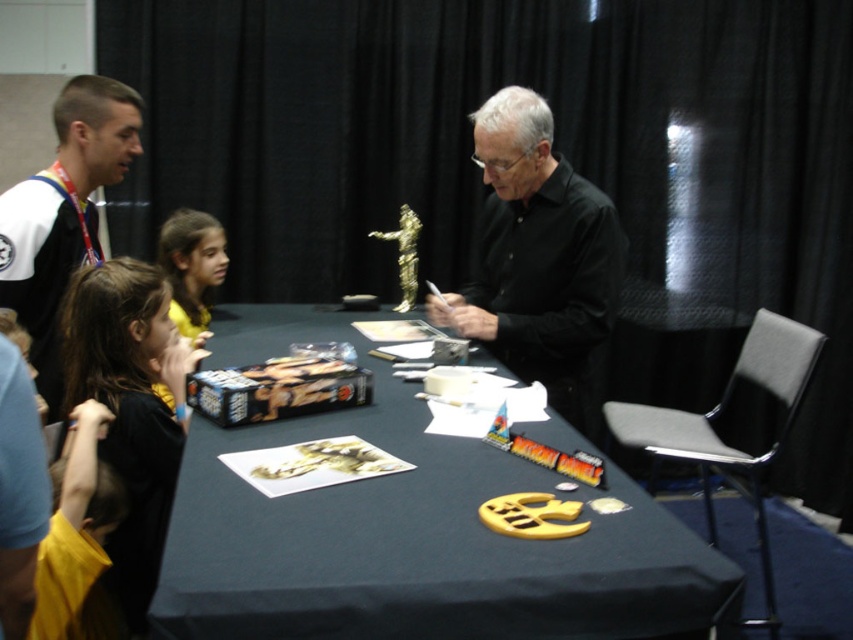
Question: Based on their relative distances, which object is nearer to the black matte shirt at center?

Choices:
 (A) dark brown hair at left
 (B) yellow fabric shirt at lower left

Answer: (A)

Question: Can you confirm if black matte shirt at center is thinner than dark brown hair at left?

Choices:
 (A) no
 (B) yes

Answer: (A)

Question: Which point appears farthest from the camera in this image?

Choices:
 (A) (550, 296)
 (B) (136, 154)
 (C) (621, 525)
 (D) (119, 352)

Answer: (A)

Question: Which point appears farthest from the camera in this image?

Choices:
 (A) (175, 538)
 (B) (126, 547)
 (C) (64, 548)

Answer: (B)

Question: Does matte black table at center have a larger size compared to black matte shirt at center?

Choices:
 (A) yes
 (B) no

Answer: (A)

Question: Can you confirm if black matte shirt at center is positioned below yellow fabric shirt at lower left?

Choices:
 (A) no
 (B) yes

Answer: (A)